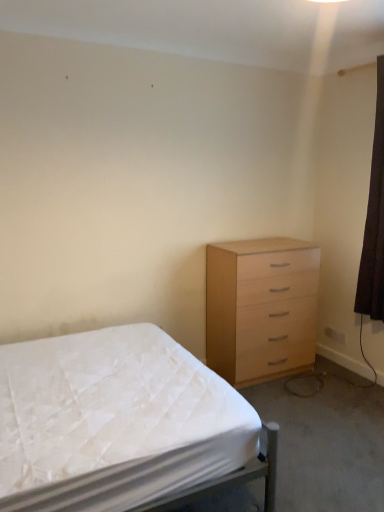
Question: Does point tap(377, 143) appear closer or farther from the camera than point tap(208, 246)?

Choices:
 (A) closer
 (B) farther

Answer: (A)

Question: Do you think brown fabric curtain at right is within light wood chest of drawers at right, or outside of it?

Choices:
 (A) outside
 (B) inside

Answer: (A)

Question: Based on their relative distances, which object is nearer to the light wood chest of drawers at right?

Choices:
 (A) brown fabric curtain at right
 (B) white fabric bed at lower left

Answer: (A)

Question: Considering the real-world distances, which object is farthest from the white fabric bed at lower left?

Choices:
 (A) brown fabric curtain at right
 (B) light wood chest of drawers at right

Answer: (A)